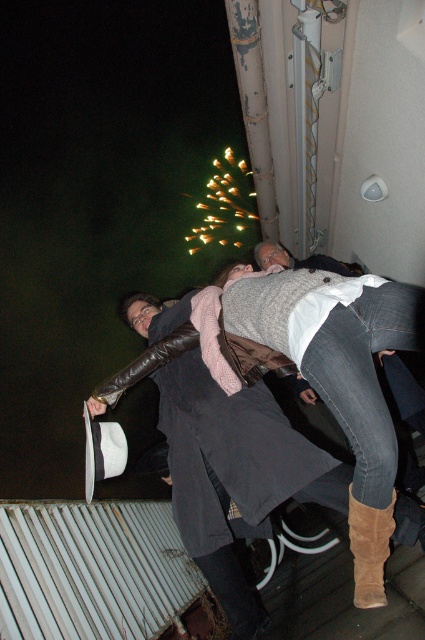
Question: Can you confirm if matte black coat at center is wider than suede boot at lower right?

Choices:
 (A) no
 (B) yes

Answer: (B)

Question: Does matte black coat at center have a lesser width compared to suede boot at lower right?

Choices:
 (A) yes
 (B) no

Answer: (B)

Question: Which point is farther to the camera?

Choices:
 (A) matte black coat at center
 (B) suede boot at lower right

Answer: (A)

Question: Which object appears closest to the camera in this image?

Choices:
 (A) matte black coat at center
 (B) suede boot at lower right

Answer: (B)

Question: Which object appears closest to the camera in this image?

Choices:
 (A) matte black coat at center
 (B) suede boot at lower right

Answer: (B)

Question: Does matte black coat at center appear on the left side of suede boot at lower right?

Choices:
 (A) yes
 (B) no

Answer: (A)